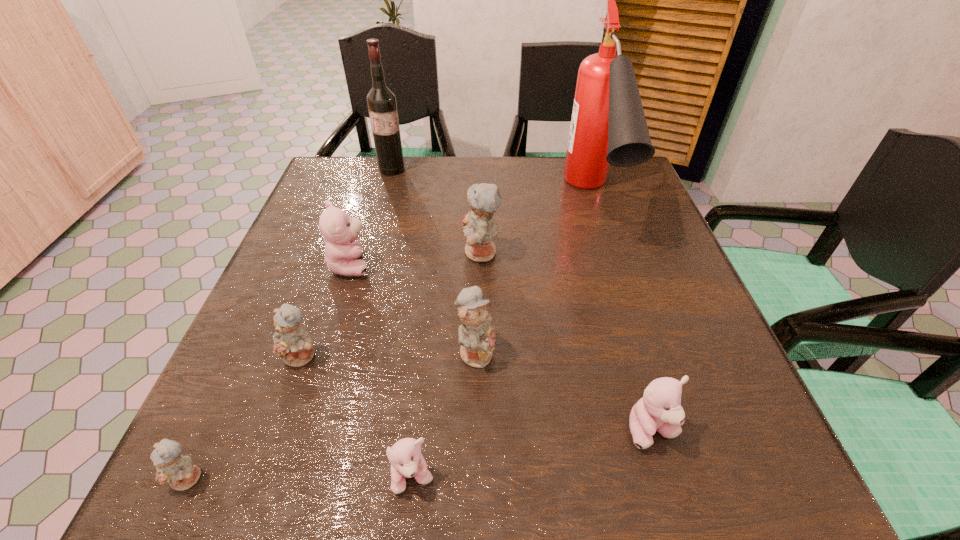
What are the coordinates of `object that is the eighth closest one to the leftmost pink teddy bear` in the screenshot? It's located at (659, 409).

The image size is (960, 540). I want to click on teddy bear that is the second closest to the farthest pink teddy bear, so click(480, 228).

The image size is (960, 540). What are the coordinates of `teddy bear identified as the third closest to the leftmost object` in the screenshot? It's located at [475, 335].

At what (x,y) coordinates should I click in order to perform the action: click on blue teddy bear that stands as the fourth closest to the second tallest object. Please return your answer as a coordinate pair (x, y). This screenshot has height=540, width=960. Looking at the image, I should click on (179, 471).

Identify which blue teddy bear is the third closest to the second blue teddy bear from left to right. Please provide its 2D coordinates. Your answer should be formatted as a tuple, i.e. [(x, y)], where the tuple contains the x and y coordinates of a point satisfying the conditions above.

[(480, 228)]

This screenshot has width=960, height=540. Identify the location of pink teddy bear that is the second closest to the rightmost teddy bear. (342, 252).

This screenshot has height=540, width=960. I want to click on pink teddy bear that is the closest to the smallest blue teddy bear, so click(405, 456).

Where is `free space that satisfies the following two spatial constraints: 1. at the face of the farthest pink teddy bear; 2. on the front-facing side of the leftmost blue teddy bear`? The width and height of the screenshot is (960, 540). free space that satisfies the following two spatial constraints: 1. at the face of the farthest pink teddy bear; 2. on the front-facing side of the leftmost blue teddy bear is located at coordinates pyautogui.click(x=284, y=478).

Locate an element on the screen. The height and width of the screenshot is (540, 960). vacant area that satisfies the following two spatial constraints: 1. at the nozzle of the fire extinguisher; 2. at the face of the biggest pink teddy bear is located at coordinates (612, 265).

In order to click on free spot that satisfies the following two spatial constraints: 1. at the nozzle of the tallest object; 2. on the front-facing side of the second biggest blue teddy bear in this screenshot , I will do `click(639, 351)`.